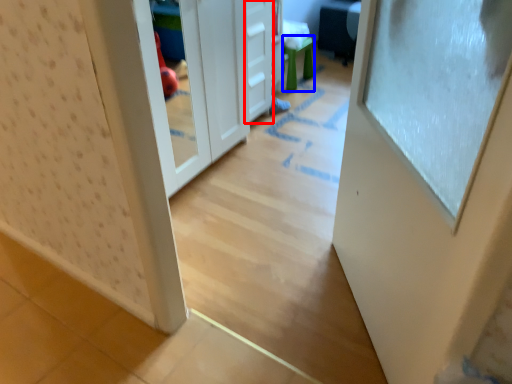
Question: Among these objects, which one is farthest to the camera, drawer (highlighted by a red box) or stool (highlighted by a blue box)?

Choices:
 (A) drawer
 (B) stool

Answer: (B)